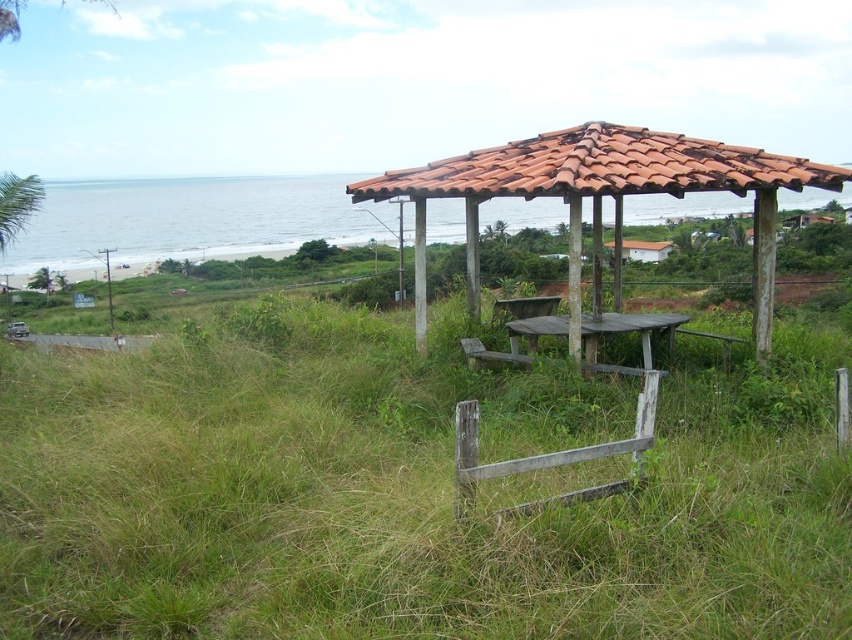
Question: Which point is closer to the camera?

Choices:
 (A) wooden park bench at center
 (B) wooden picnic table at center
 (C) white matte house at center

Answer: (B)

Question: Which object appears closest to the camera in this image?

Choices:
 (A) blue water at upper center
 (B) green grassy at center
 (C) white matte house at center

Answer: (B)

Question: Is green grassy at center to the right of wooden picnic table at center from the viewer's perspective?

Choices:
 (A) yes
 (B) no

Answer: (B)

Question: Which is farther from the white matte house at center?

Choices:
 (A) blue water at upper center
 (B) wooden park bench at center

Answer: (A)

Question: Can you confirm if wooden picnic table at center is positioned above wooden park bench at center?

Choices:
 (A) yes
 (B) no

Answer: (B)

Question: Is green grassy at center behind wooden picnic table at center?

Choices:
 (A) no
 (B) yes

Answer: (A)